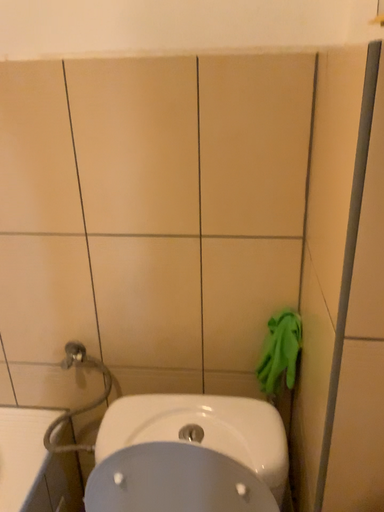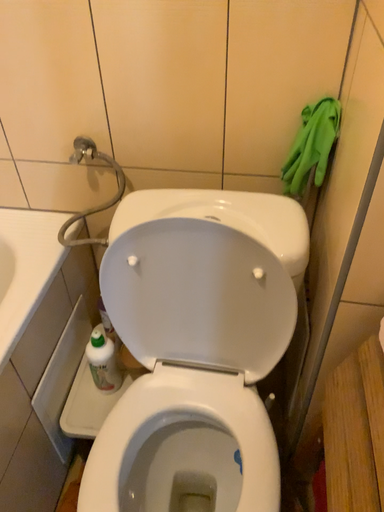
Question: How did the camera likely rotate when shooting the video?

Choices:
 (A) rotated downward
 (B) rotated upward

Answer: (A)